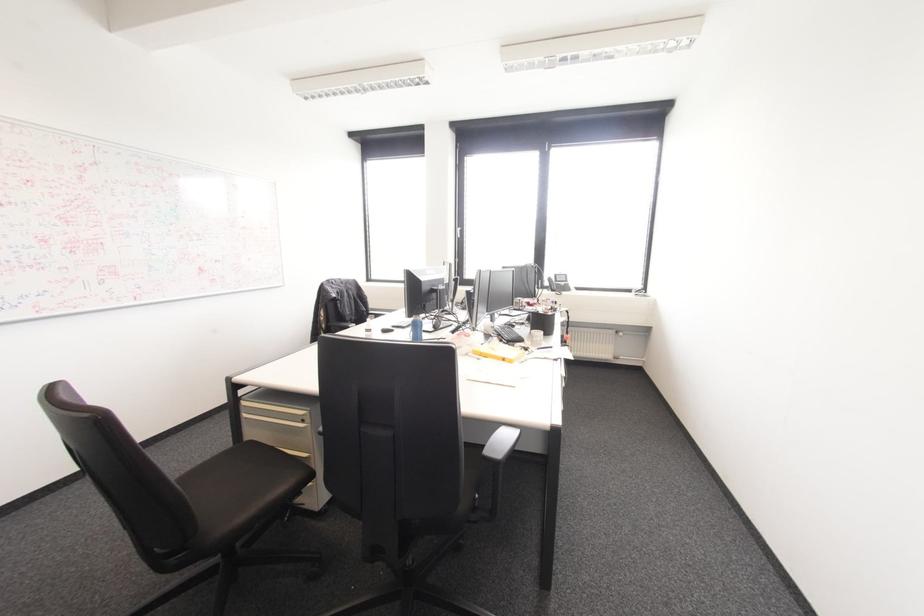
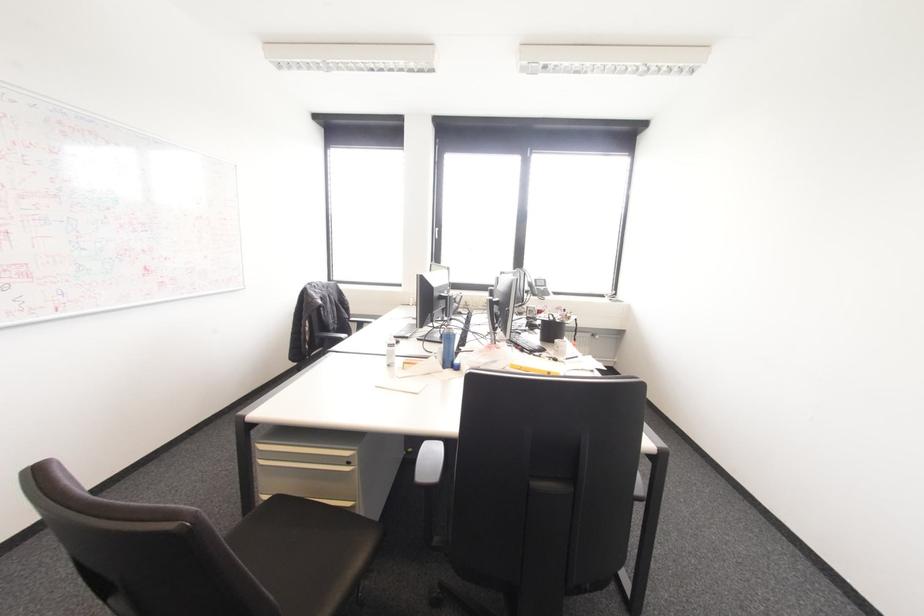
Which direction would the cameraman need to move to produce the second image?

The cameraman moved toward left, forward.